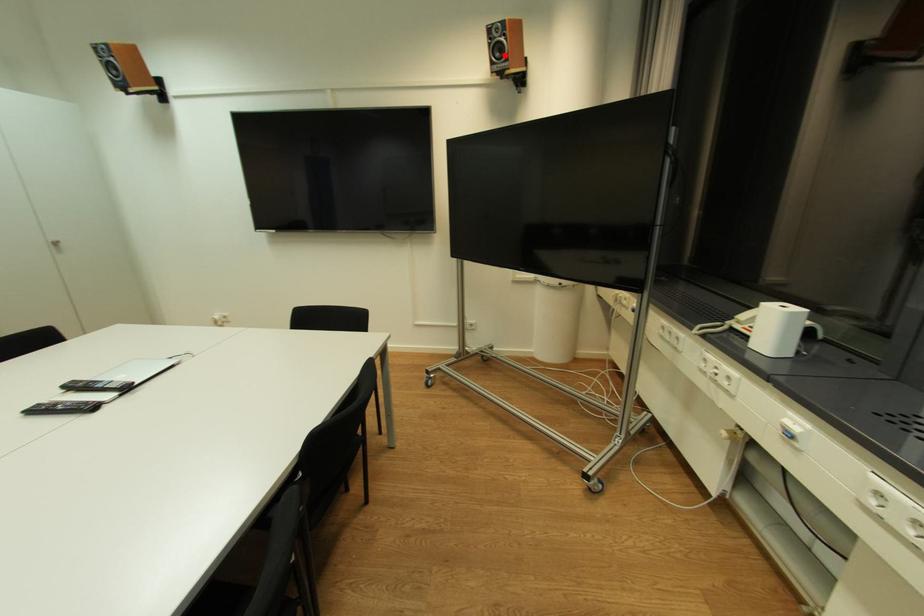
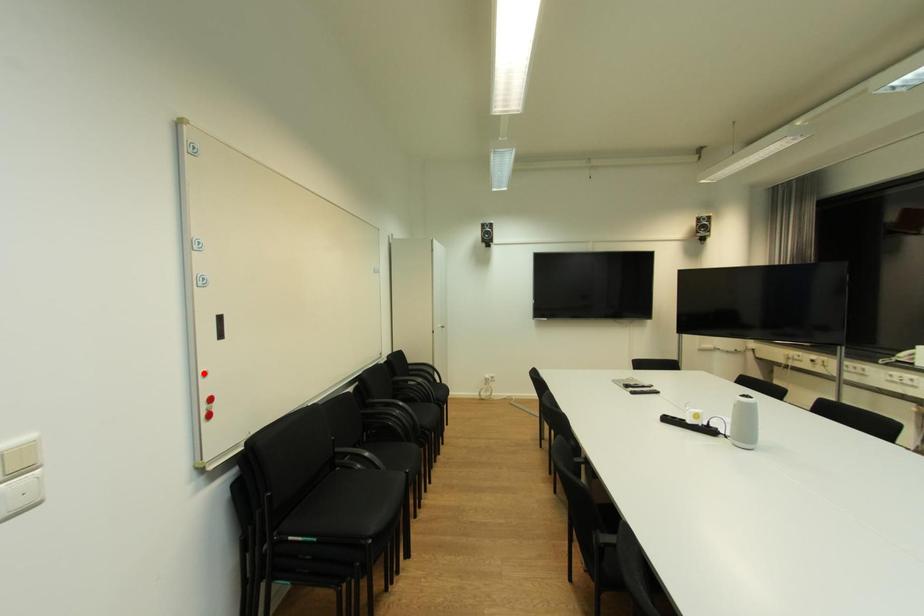
I am providing you with two images of the same scene from different viewpoints. A red point is marked on the first image and another point is marked on the second image. Do the highlighted points in image1 and image2 indicate the same real-world spot?

No